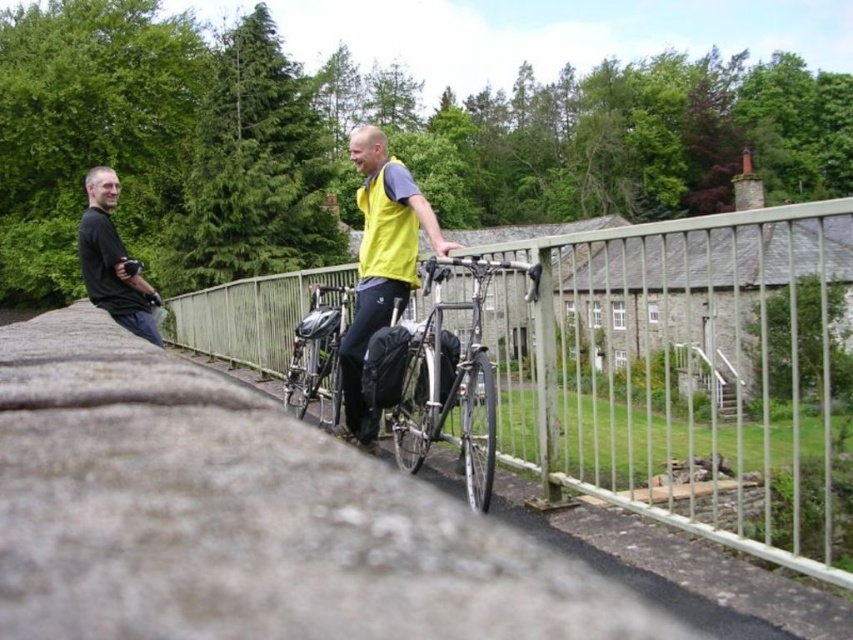
Question: From the image, what is the correct spatial relationship of shiny metallic bicycle at center in relation to shiny black bicycle at center?

Choices:
 (A) below
 (B) above

Answer: (B)

Question: Which of the following is the closest to the observer?

Choices:
 (A) shiny metallic bicycle at center
 (B) metallic silver fence at center
 (C) matte black camera at left
 (D) shiny black bicycle at center

Answer: (B)

Question: Which object appears farthest from the camera in this image?

Choices:
 (A) metallic silver fence at center
 (B) shiny black bicycle at center
 (C) matte black camera at left

Answer: (C)

Question: Can you confirm if metallic silver fence at center is bigger than yellow fabric vest at center?

Choices:
 (A) no
 (B) yes

Answer: (B)

Question: Estimate the real-world distances between objects in this image. Which object is farther from the matte black camera at left?

Choices:
 (A) metallic silver fence at center
 (B) yellow fabric vest at center
 (C) shiny metallic bicycle at center
 (D) shiny black bicycle at center

Answer: (A)

Question: Observing the image, what is the correct spatial positioning of yellow fabric vest at center in reference to matte black camera at left?

Choices:
 (A) below
 (B) above

Answer: (A)